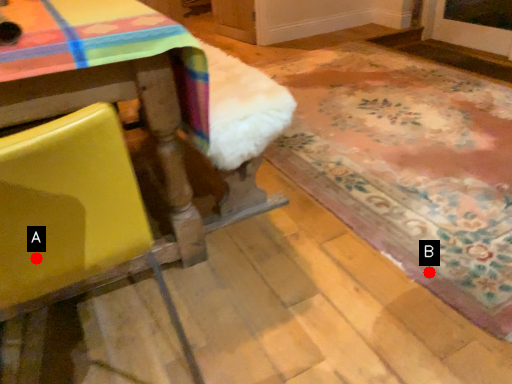
Question: Two points are circled on the image, labeled by A and B beside each circle. Which of the following is the farthest from the observer?

Choices:
 (A) A is further
 (B) B is further

Answer: (B)